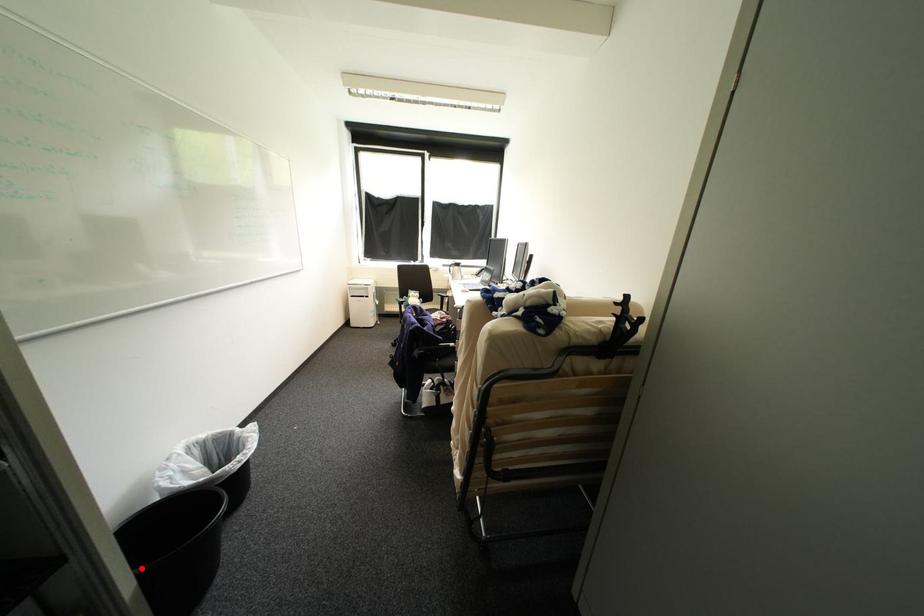
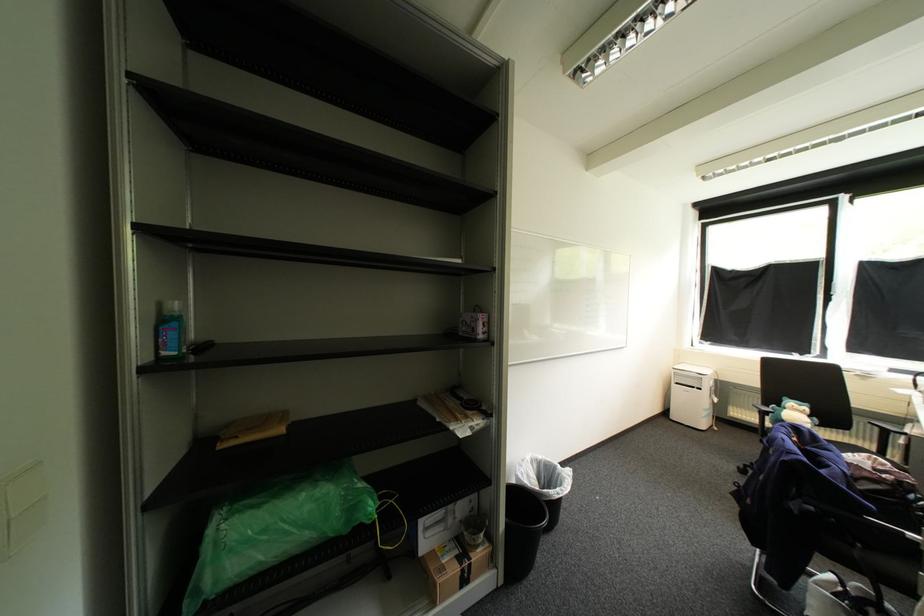
Find the pixel in the second image that matches the highlighted location in the first image.

(513, 517)